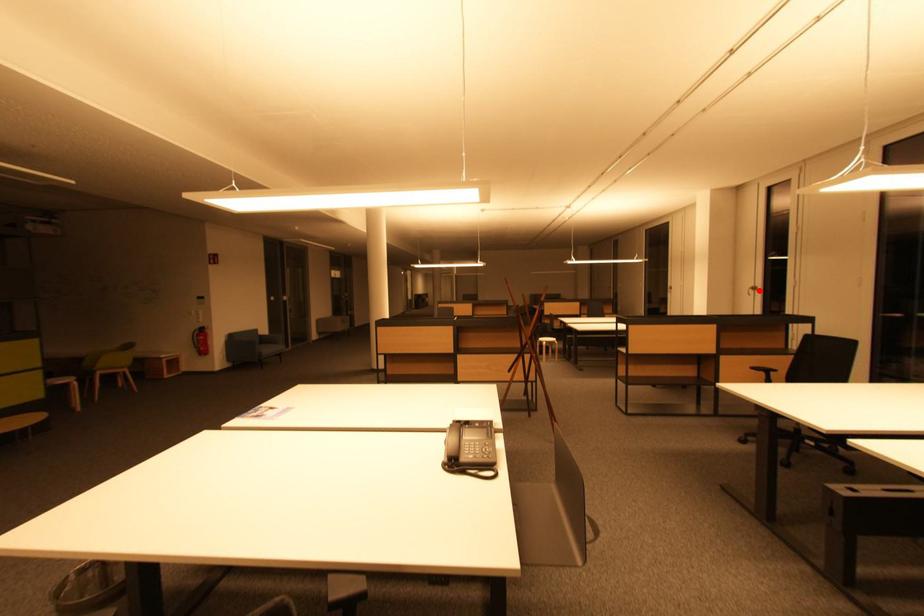
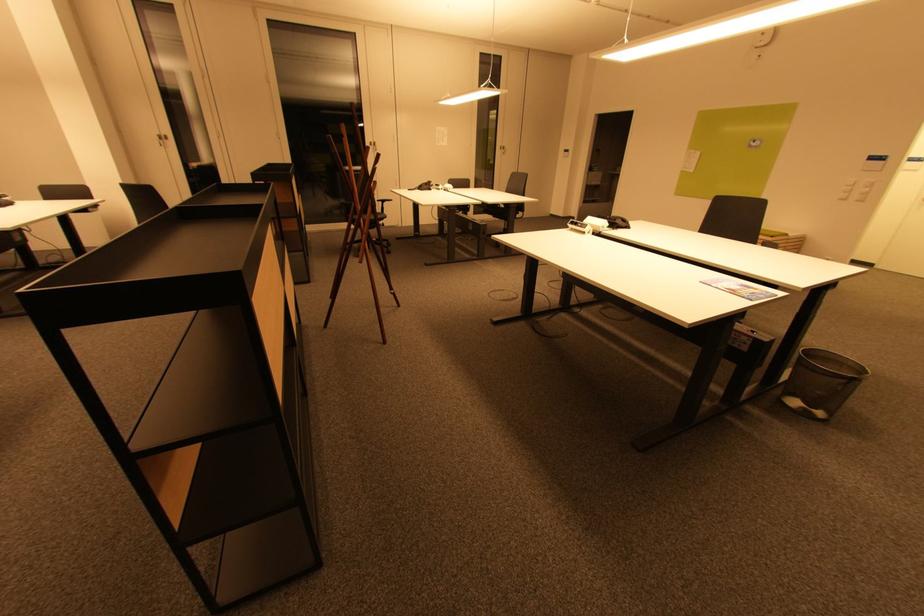
Question: A red point is marked in image1. In image2, is the corresponding 3D point closer to the camera or farther? Reply with the corresponding letter.

Choices:
 (A) The corresponding 3D point is closer.
 (B) The corresponding 3D point is farther.

Answer: (B)